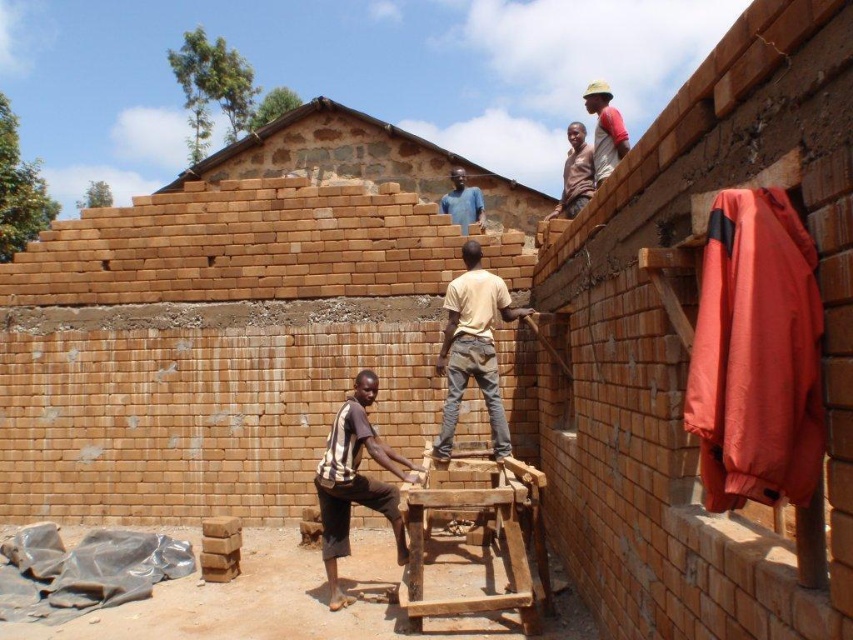
Does point (469, 285) come behind point (619, 140)?

No.

Who is higher up, tan cotton shirt at center or light brown wooden pole at upper center?

Positioned higher is light brown wooden pole at upper center.

Find the location of a particular element. The width and height of the screenshot is (853, 640). tan cotton shirt at center is located at coordinates (473, 348).

Is brown striped shirt at lower center to the left of matte brown shirt at upper center from the viewer's perspective?

Correct, you'll find brown striped shirt at lower center to the left of matte brown shirt at upper center.

Describe the element at coordinates (355, 483) in the screenshot. I see `brown striped shirt at lower center` at that location.

Is point (376, 449) positioned in front of point (592, 168)?

Yes, point (376, 449) is closer to viewer.

The image size is (853, 640). In order to click on brown striped shirt at lower center in this screenshot , I will do `click(355, 483)`.

Is matte brown shirt at upper center to the right of blue matte shirt at upper center from the viewer's perspective?

Indeed, matte brown shirt at upper center is positioned on the right side of blue matte shirt at upper center.

Which is in front, point (570, 211) or point (457, 209)?

Positioned in front is point (570, 211).

Find the location of a particular element. matte brown shirt at upper center is located at coordinates (575, 173).